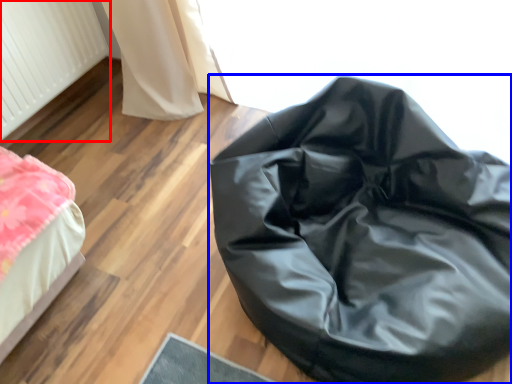
Question: Which object is further to the camera taking this photo, radiator (highlighted by a red box) or furniture (highlighted by a blue box)?

Choices:
 (A) radiator
 (B) furniture

Answer: (A)